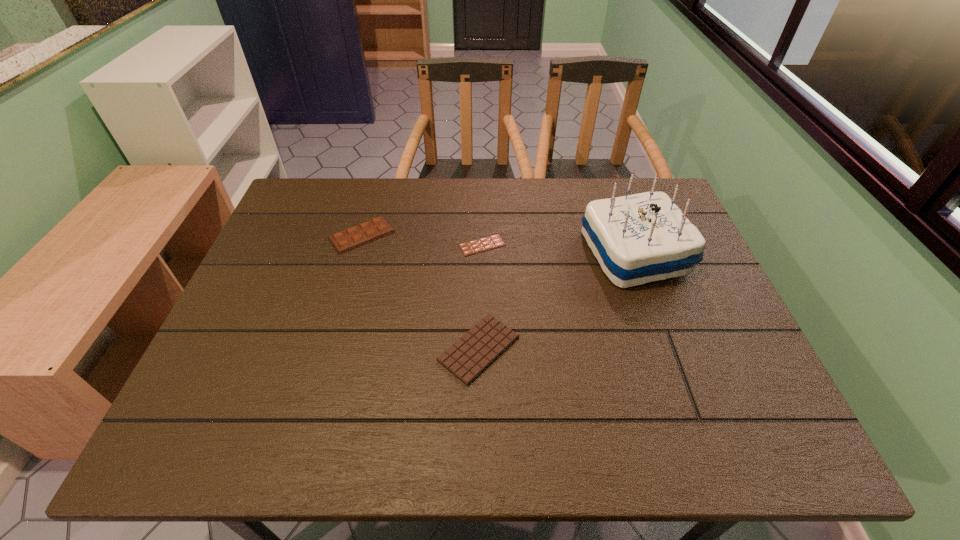
You are a GUI agent. You are given a task and a screenshot of the screen. Output one action in this format:
    pyautogui.click(x=<x>, y=<y>)
    Task: Click on the free point between the nearest object and the third shortest object
    Image resolution: width=960 pixels, height=540 pixels.
    Given the screenshot: What is the action you would take?
    pyautogui.click(x=420, y=292)

Locate an element on the screen. unoccupied area between the leftmost object and the nearest object is located at coordinates (420, 292).

Identify which object is the second closest to the nearest object. Please provide its 2D coordinates. Your answer should be formatted as a tuple, i.e. [(x, y)], where the tuple contains the x and y coordinates of a point satisfying the conditions above.

[(640, 238)]

Select which object appears as the third closest to the shortest chocolate bar. Please provide its 2D coordinates. Your answer should be formatted as a tuple, i.e. [(x, y)], where the tuple contains the x and y coordinates of a point satisfying the conditions above.

[(640, 238)]

Find the location of a particular element. The height and width of the screenshot is (540, 960). the closest chocolate bar to the birthday cake is located at coordinates (468, 357).

The image size is (960, 540). I want to click on chocolate bar that is the second closest one to the second shortest object, so click(x=351, y=238).

Identify the location of vacant area in the image that satisfies the following two spatial constraints: 1. on the back side of the nearest chocolate bar; 2. on the left side of the rightmost object. This screenshot has width=960, height=540. (479, 253).

The image size is (960, 540). I want to click on vacant space that satisfies the following two spatial constraints: 1. on the front side of the shortest object; 2. on the left side of the tallest object, so click(x=482, y=253).

The height and width of the screenshot is (540, 960). In order to click on free space that satisfies the following two spatial constraints: 1. on the front side of the birthday cake; 2. on the right side of the shortest object in this screenshot , I will do `click(482, 253)`.

I want to click on vacant region that satisfies the following two spatial constraints: 1. on the back side of the nearest object; 2. on the right side of the shortest object, so click(x=479, y=245).